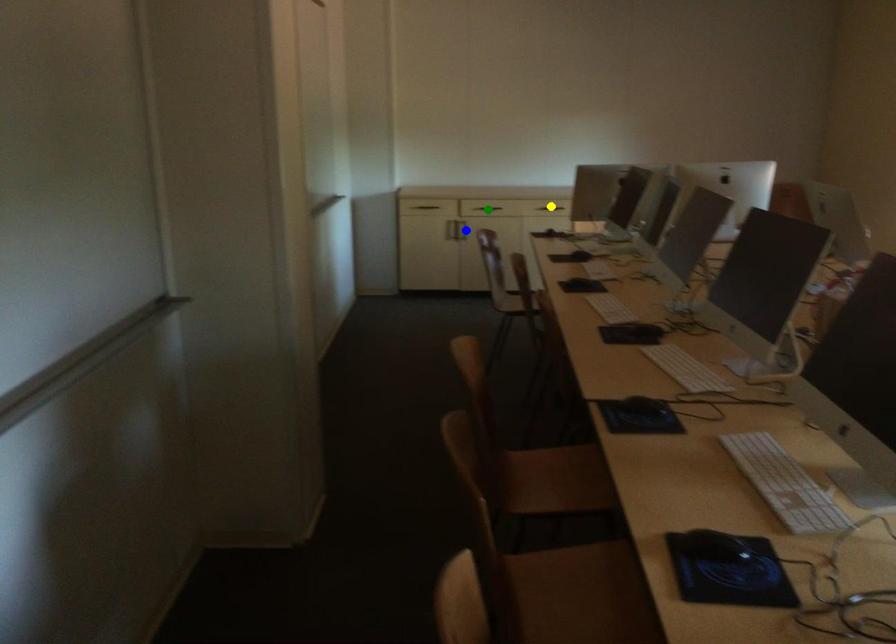
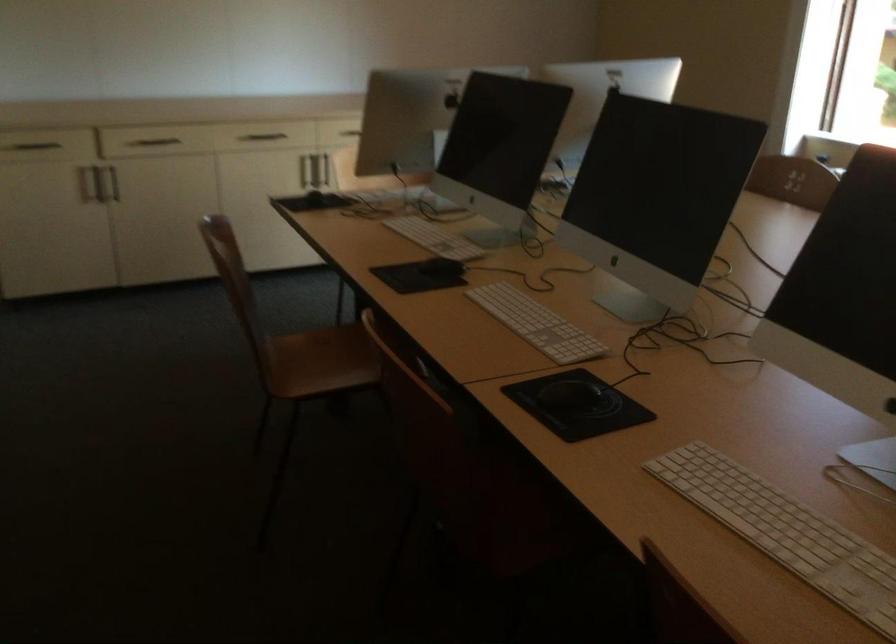
I am providing you with two images of the same scene from different viewpoints. Three points are marked in image1. Which point corresponds to a part or object that is occluded in image2?In image1, three points are marked. Which of them correspond to a part or object that is occluded in image2?Among the three points shown in image1, which one corresponds to a part or object that is no longer visible due to occlusion in image2?

Invisible in image2: blue point, green point, yellow point.